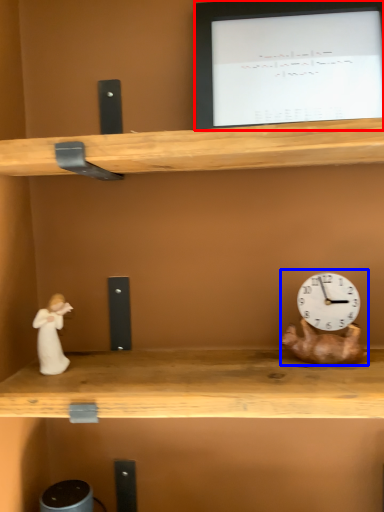
Question: Which of the following is the closest to the observer, computer monitor (highlighted by a red box) or toy (highlighted by a blue box)?

Choices:
 (A) computer monitor
 (B) toy

Answer: (B)